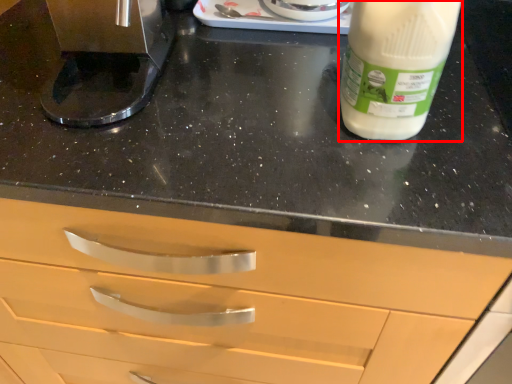
Question: Observing the image, what is the correct spatial positioning of yoghurt (annotated by the red box) in reference to coffee machine?

Choices:
 (A) right
 (B) left

Answer: (A)